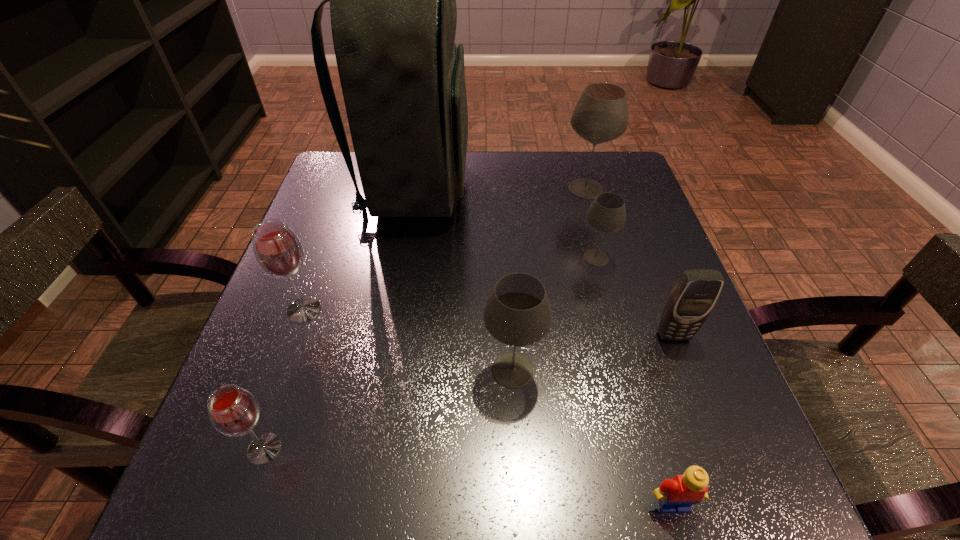
The width and height of the screenshot is (960, 540). What are the coordinates of `backpack` in the screenshot? It's located at (393, 11).

I want to click on gray backpack, so click(393, 11).

The height and width of the screenshot is (540, 960). I want to click on the biggest gray wineglass, so (601, 115).

This screenshot has height=540, width=960. Identify the location of the farthest gray wineglass. (601, 115).

I want to click on the farther red wineglass, so click(x=278, y=251).

At what (x,y) coordinates should I click in order to perform the action: click on the third farthest wineglass. Please return your answer as a coordinate pair (x, y). The image size is (960, 540). Looking at the image, I should click on (278, 251).

Identify the location of the sixth farthest object. (517, 313).

Identify the location of the leftmost gray wineglass. (517, 313).

At what (x,y) coordinates should I click in order to perform the action: click on cellular telephone. Please return your answer as a coordinate pair (x, y). This screenshot has width=960, height=540. Looking at the image, I should click on (695, 293).

You are a GUI agent. You are given a task and a screenshot of the screen. Output one action in this format:
    pyautogui.click(x=<x>, y=<y>)
    Task: Click on the smaller red wineglass
    This screenshot has height=540, width=960.
    Given the screenshot: What is the action you would take?
    tap(233, 411)